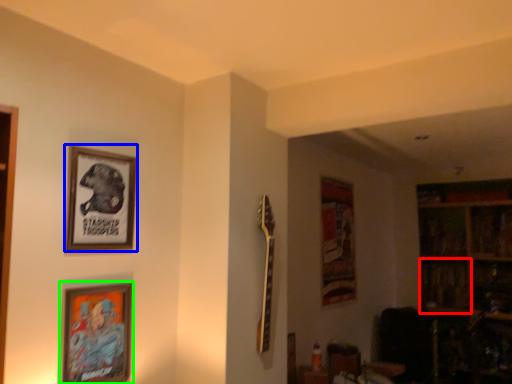
Question: Which object is the farthest from shelf (highlighted by a red box)? Choose among these: picture frame (highlighted by a blue box) or picture frame (highlighted by a green box).

Choices:
 (A) picture frame
 (B) picture frame

Answer: (A)